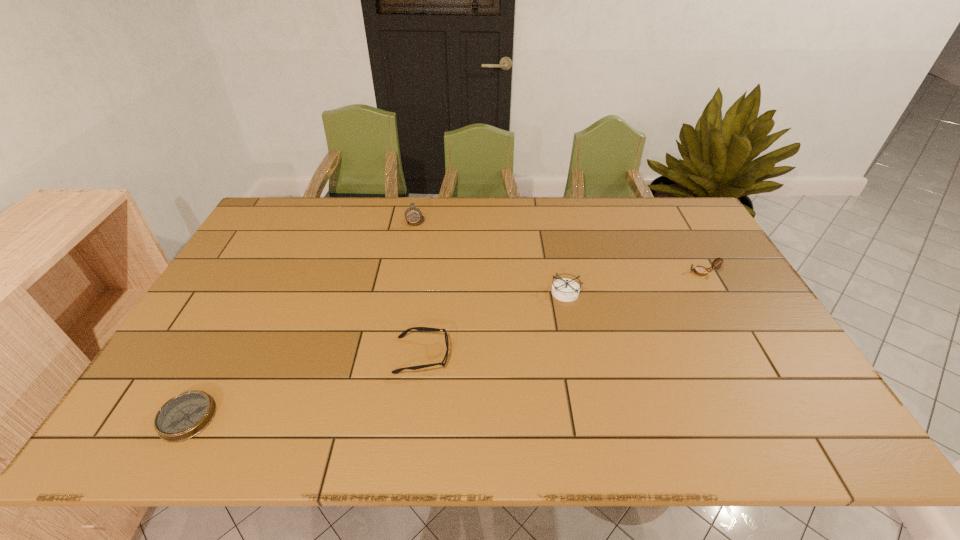
Identify the location of object at the right edge. Image resolution: width=960 pixels, height=540 pixels. (700, 270).

Locate an element on the screen. object at the near left corner is located at coordinates [x=182, y=417].

Where is `vacant space at the far edge of the desktop`? This screenshot has width=960, height=540. vacant space at the far edge of the desktop is located at coordinates (545, 214).

In the image, there is a desktop. Where is `vacant space at the near edge`? vacant space at the near edge is located at coordinates (717, 442).

Where is `blank area at the left edge`? blank area at the left edge is located at coordinates (279, 248).

The width and height of the screenshot is (960, 540). In the image, there is a desktop. What are the coordinates of `vacant space at the right edge` in the screenshot? It's located at (708, 292).

Find the location of a particular element. vacant area between the fourth nearest object and the second compass from left to right is located at coordinates (560, 246).

Find the location of a particular element. free point between the second farthest compass and the second nearest compass is located at coordinates (635, 282).

Locate an element on the screen. The width and height of the screenshot is (960, 540). unoccupied area between the fourth farthest object and the shortest object is located at coordinates (304, 386).

At what (x,y) coordinates should I click in order to perform the action: click on free point between the rightmost object and the third farthest compass. Please return your answer as a coordinate pair (x, y). Looking at the image, I should click on (635, 282).